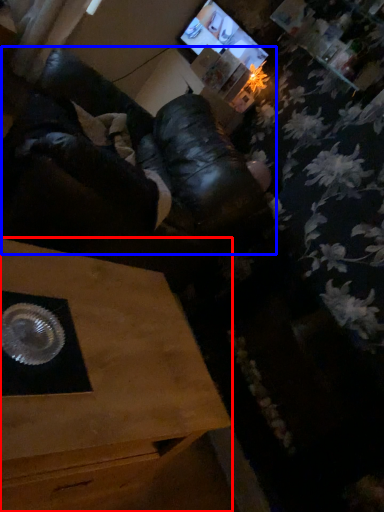
Question: Among these objects, which one is nearest to the camera, table (highlighted by a red box) or squat (highlighted by a blue box)?

Choices:
 (A) table
 (B) squat

Answer: (A)